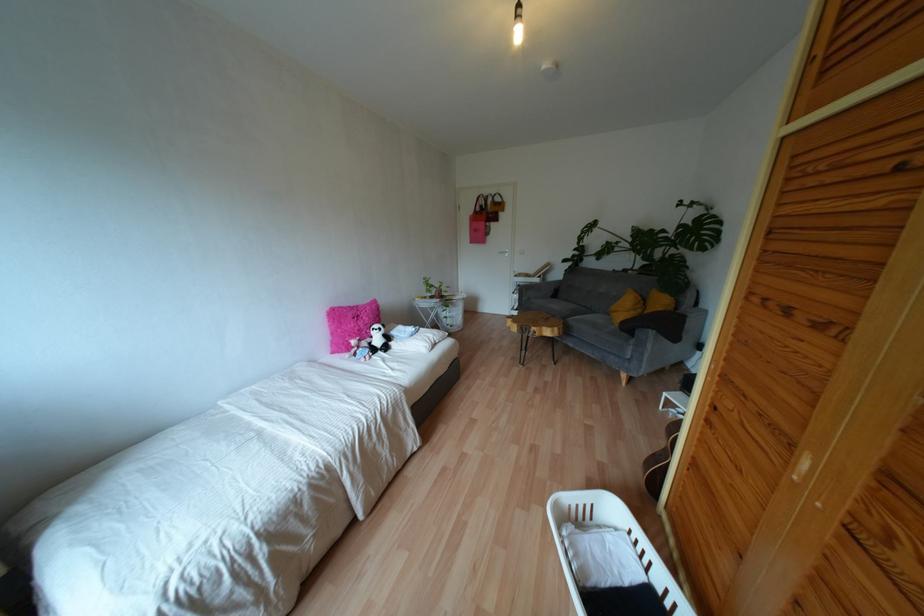
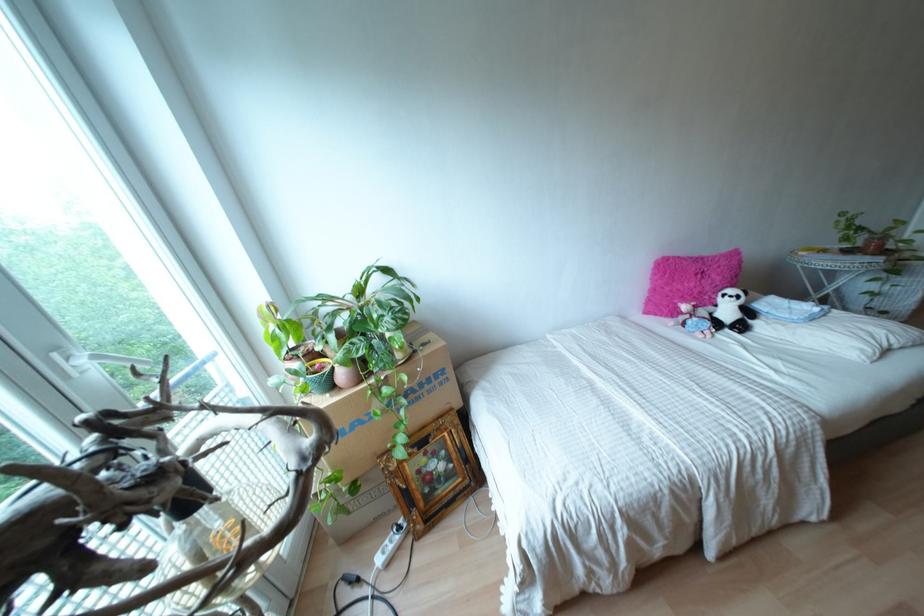
Question: How did the camera likely rotate?

Choices:
 (A) Left
 (B) Right
 (C) Up
 (D) Down

Answer: (A)